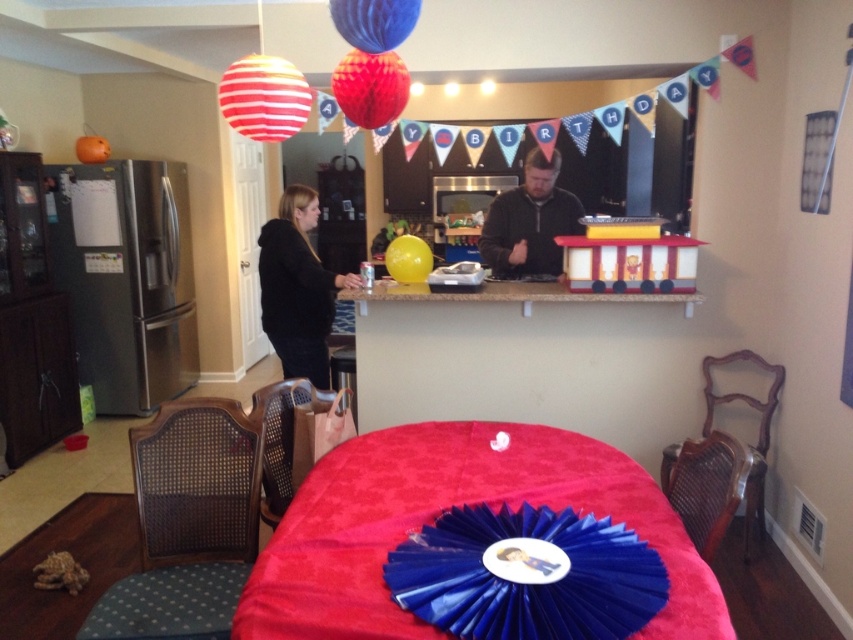
You are planning to place a rectangular cake on the table. The cake is 1.2 meters long. Can the red velvet table at center accommodate the cake without overhanging the edges? Please consider the table size relative to the black fleece jacket at center.

The red velvet table at center is wider than the black fleece jacket at center. Since the cake is 1.2 meters long, if the table is sufficiently large enough to accommodate this length, it should be possible. However, without exact measurements, we can only confirm that the table is wider than the jacket, but cannot guarantee the cake will fit perfectly.

You are planning to place a decorative item in the center of the table. You have both the shiny blue paper fan at center and the yellow matte balloon at center. Which one should you choose if you want the item to be more prominent?

The shiny blue paper fan at center is larger in size than the yellow matte balloon at center, so choosing the shiny blue paper fan at center will make the item more prominent.